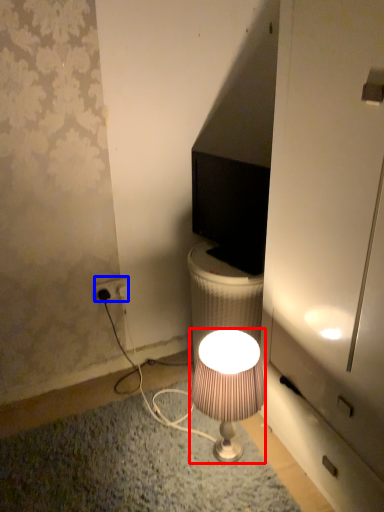
Question: Which point is further to the camera, lamp (highlighted by a red box) or power outlet (highlighted by a blue box)?

Choices:
 (A) lamp
 (B) power outlet

Answer: (B)